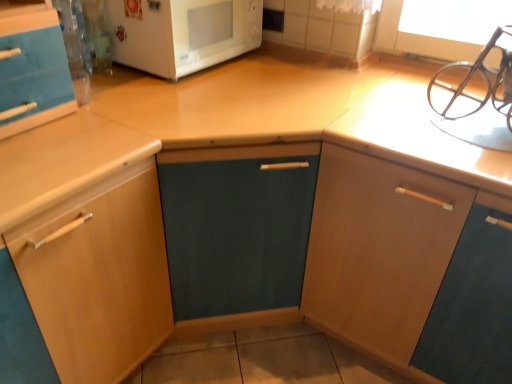
At what (x,y) coordinates should I click in order to perform the action: click on free space to the back side of metallic silver sink at upper right. Please return your answer as a coordinate pair (x, y). The height and width of the screenshot is (384, 512). Looking at the image, I should click on (424, 88).